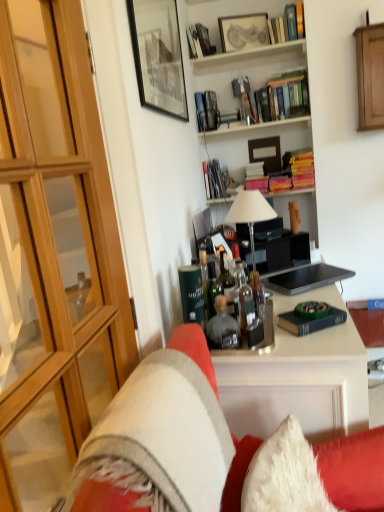
Question: Can we say velvet-like beige couch at center lies outside matte black picture frame at upper center, the first picture frame when ordered from right to left?

Choices:
 (A) yes
 (B) no

Answer: (A)

Question: Can you confirm if velvet-like beige couch at center is positioned to the left of matte black picture frame at upper center, the second picture frame from the bottom?

Choices:
 (A) yes
 (B) no

Answer: (A)

Question: Could you tell me if velvet-like beige couch at center is facing matte black picture frame at upper center, which is the first picture frame in top-to-bottom order?

Choices:
 (A) no
 (B) yes

Answer: (A)

Question: Considering the relative positions of velvet-like beige couch at center and matte black picture frame at upper center, the 2th picture frame in the left-to-right sequence, in the image provided, is velvet-like beige couch at center behind matte black picture frame at upper center, the 2th picture frame in the left-to-right sequence,?

Choices:
 (A) yes
 (B) no

Answer: (B)

Question: From a real-world perspective, is velvet-like beige couch at center on matte black picture frame at upper center, which ranks as the 1th picture frame in back-to-front order?

Choices:
 (A) yes
 (B) no

Answer: (B)

Question: Is hardcover book at center, arranged as the 1th book when viewed from the back, bigger or smaller than hardcover books at upper center, the 4th book when ordered from back to front?

Choices:
 (A) small
 (B) big

Answer: (B)

Question: In terms of height, does hardcover book at center, which is the 7th book from front to back, look taller or shorter compared to hardcover books at upper center, the 3th book from the bottom?

Choices:
 (A) short
 (B) tall

Answer: (B)

Question: Do you think hardcover book at center, arranged as the 1th book when viewed from the back, is within hardcover books at upper center, acting as the fourth book starting from the front, or outside of it?

Choices:
 (A) outside
 (B) inside

Answer: (A)

Question: Is point (216, 172) closer or farther from the camera than point (301, 160)?

Choices:
 (A) farther
 (B) closer

Answer: (A)

Question: From the image's perspective, relative to hardcover books at upper center, which is the 5th book from back to front, is hardcover book at center, the 7th book when ordered from top to bottom, above or below?

Choices:
 (A) below
 (B) above

Answer: (A)

Question: Does point (294, 315) appear closer or farther from the camera than point (297, 102)?

Choices:
 (A) closer
 (B) farther

Answer: (A)

Question: Would you say hardcover book at center, placed as the 7th book when sorted from back to front, is to the left or to the right of hardcover books at upper center, arranged as the 3th book when viewed from the front, in the picture?

Choices:
 (A) right
 (B) left

Answer: (B)

Question: From their relative heights in the image, would you say hardcover book at center, placed as the 7th book when sorted from back to front, is taller or shorter than hardcover books at upper center, which is the 5th book from back to front?

Choices:
 (A) short
 (B) tall

Answer: (A)

Question: Considering the positions of metallic silver book at upper center, acting as the 4th book starting from the bottom, and translucent glass bottles at center, the 2th bottle positioned from the left, in the image, is metallic silver book at upper center, acting as the 4th book starting from the bottom, taller or shorter than translucent glass bottles at center, the 2th bottle positioned from the left,?

Choices:
 (A) short
 (B) tall

Answer: (B)

Question: Considering the positions of point (201, 128) and point (240, 273), is point (201, 128) closer or farther from the camera than point (240, 273)?

Choices:
 (A) farther
 (B) closer

Answer: (A)